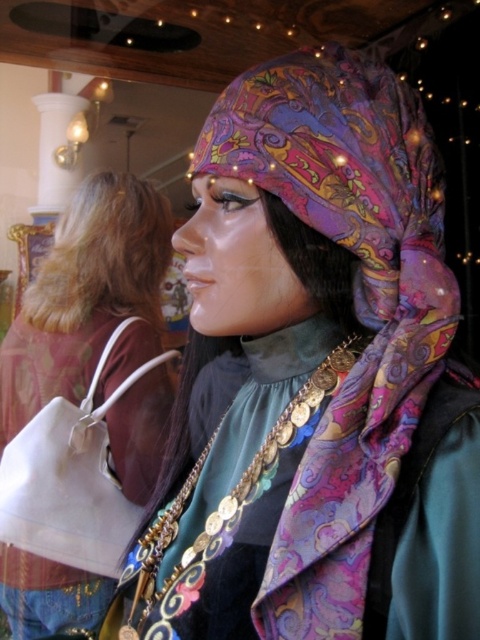
You are standing at the entrance of the boutique looking at the mannequin. There are two points marked on the mannequin, point A at coordinates point(x=215, y=241) and point B at coordinates point(x=44, y=321). Which point is closer to you?

Point A at coordinates point(x=215, y=241) is in front of point B at coordinates point(x=44, y=321), so point A is closer to you.